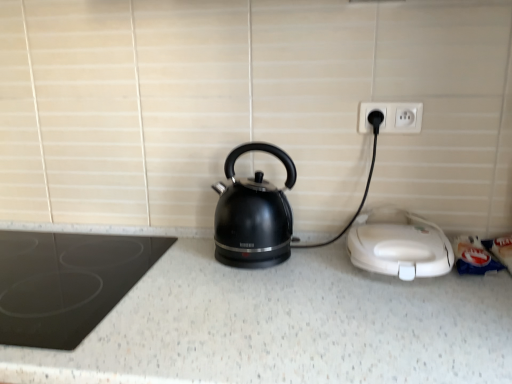
Find the location of a particular element. vacant space to the left of white plastic sandwich maker at lower right, placed as the second home appliance when sorted from left to right is located at coordinates (301, 287).